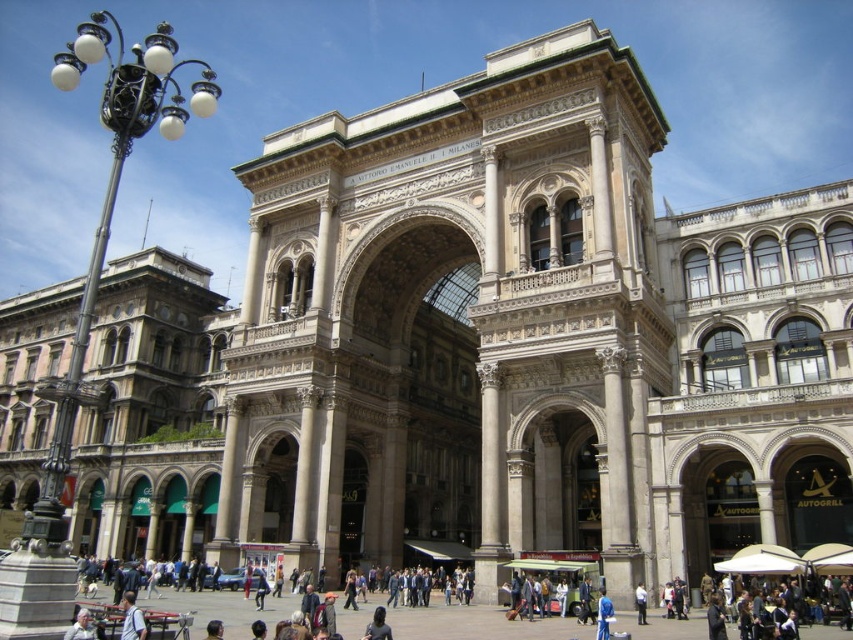
Which is in front, point (612, 612) or point (643, 589)?

Positioned in front is point (612, 612).

Does point (604, 600) come in front of point (643, 616)?

That is True.

Where is `blue fabric jacket at lower center`? Image resolution: width=853 pixels, height=640 pixels. blue fabric jacket at lower center is located at coordinates pos(602,616).

What do you see at coordinates (132, 618) in the screenshot? The width and height of the screenshot is (853, 640). I see `light blue shirt at center` at bounding box center [132, 618].

How much distance is there between light blue shirt at center and light gray fabric jacket at lower left?

2.88 meters

What do you see at coordinates (132, 618) in the screenshot?
I see `light blue shirt at center` at bounding box center [132, 618].

Image resolution: width=853 pixels, height=640 pixels. I want to click on light blue shirt at center, so click(x=132, y=618).

Is black wrought iron streetlight at left wider than dark brown hair at lower center?

Yes.

Can you confirm if black wrought iron streetlight at left is smaller than dark brown hair at lower center?

Actually, black wrought iron streetlight at left might be larger than dark brown hair at lower center.

Locate an element on the screen. This screenshot has height=640, width=853. black wrought iron streetlight at left is located at coordinates (109, 202).

In order to click on black wrought iron streetlight at left in this screenshot , I will do `click(109, 202)`.